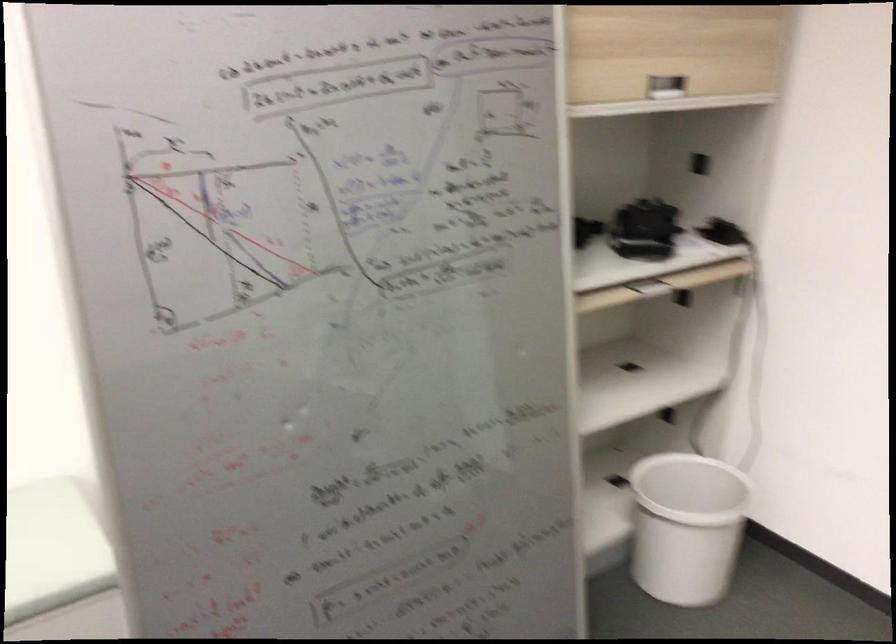
Which object does [643,230] point to?

It refers to a black electronic device.